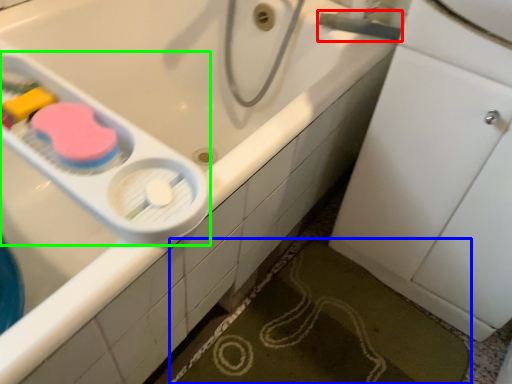
Question: Which is farther away from plumbing fixture (highlighted by a red box)? bath mat (highlighted by a blue box) or scale (highlighted by a green box)?

Choices:
 (A) bath mat
 (B) scale

Answer: (A)